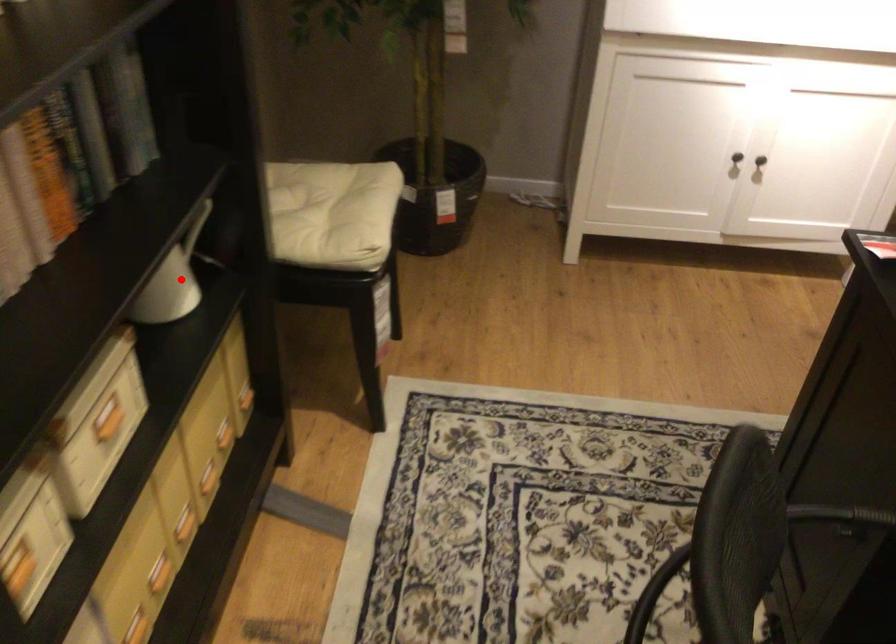
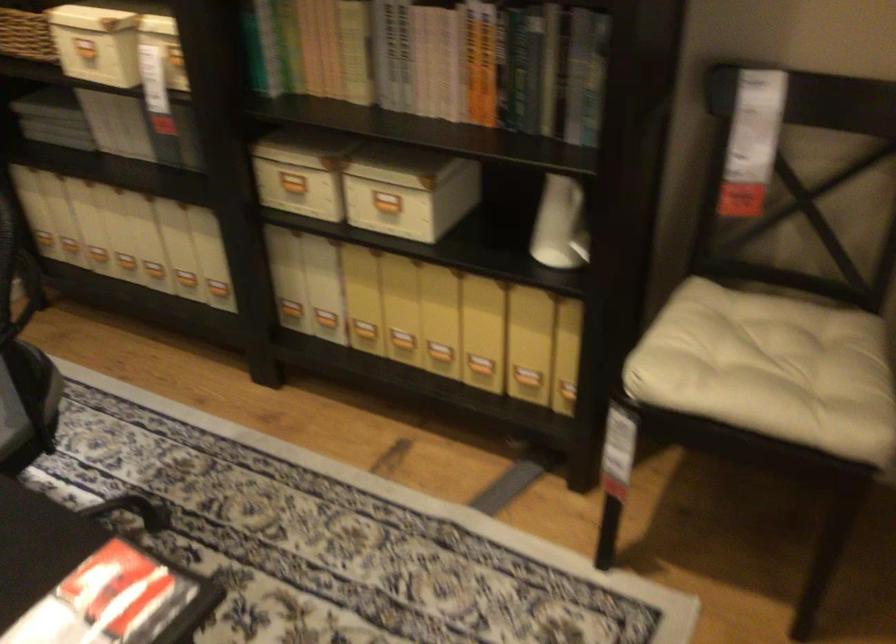
In the second image, find the point that corresponds to the highlighted location in the first image.

(582, 238)